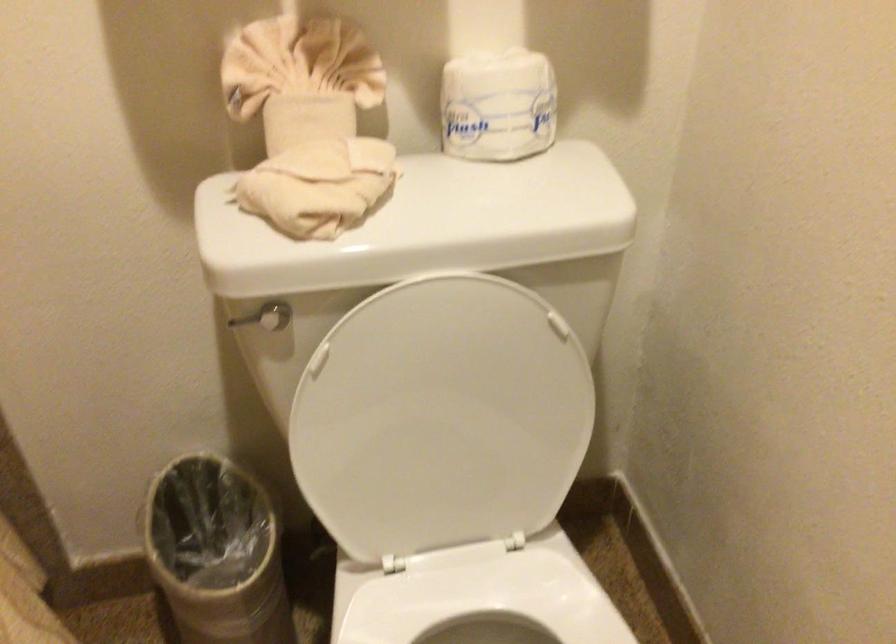
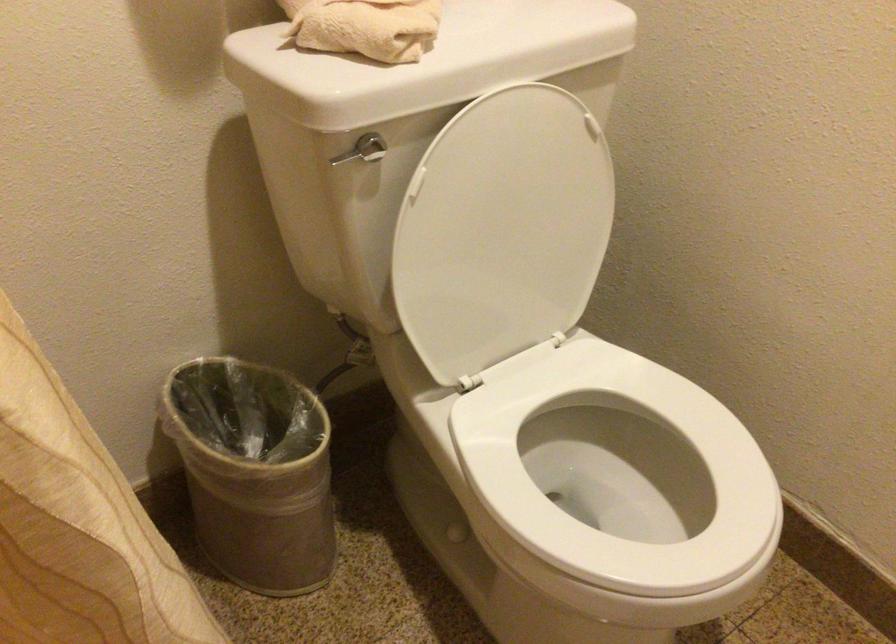
Where in the second image is the point corresponding to (x=277, y=202) from the first image?

(365, 26)